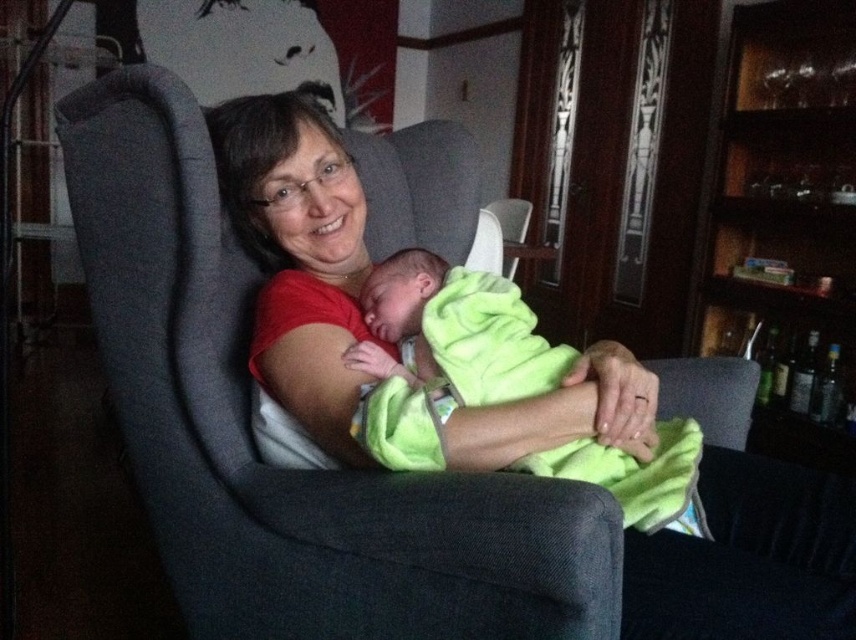
Question: Which of the following is the farthest from the observer?

Choices:
 (A) soft green blanket at center
 (B) matte red shirt at center

Answer: (A)

Question: Can you confirm if matte red shirt at center is wider than soft green blanket at center?

Choices:
 (A) no
 (B) yes

Answer: (B)

Question: In this image, where is matte red shirt at center located relative to soft green blanket at center?

Choices:
 (A) left
 (B) right

Answer: (B)

Question: Which of the following is the closest to the observer?

Choices:
 (A) matte red shirt at center
 (B) soft green blanket at center

Answer: (A)

Question: Does matte red shirt at center appear over soft green blanket at center?

Choices:
 (A) yes
 (B) no

Answer: (A)